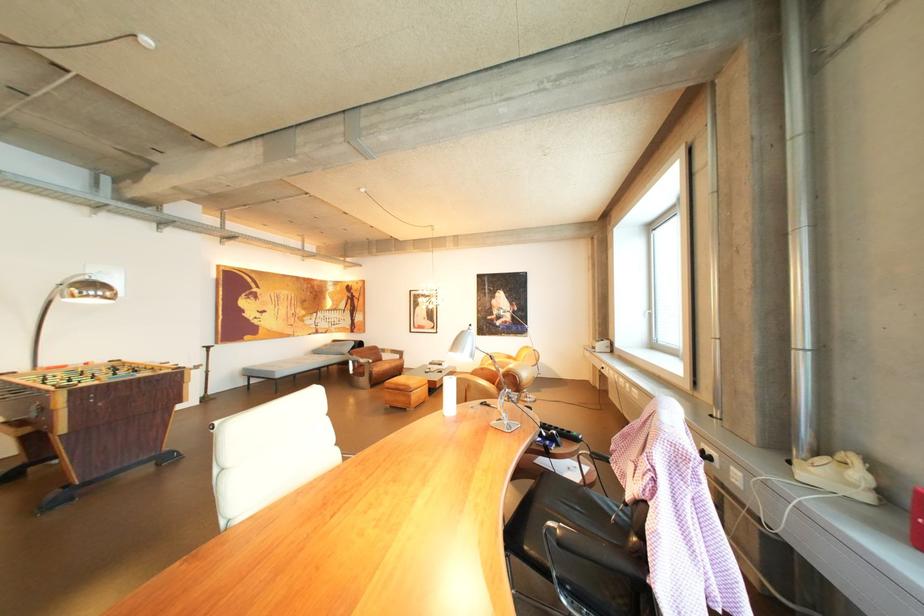
I want to click on white window handle, so click(647, 315).